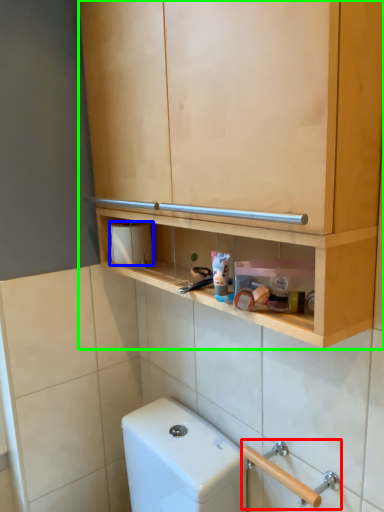
Question: Based on their relative distances, which object is nearer to door handle (highlighted by a red box)? Choose from toilet paper (highlighted by a blue box) and cabinetry (highlighted by a green box).

Choices:
 (A) toilet paper
 (B) cabinetry

Answer: (A)